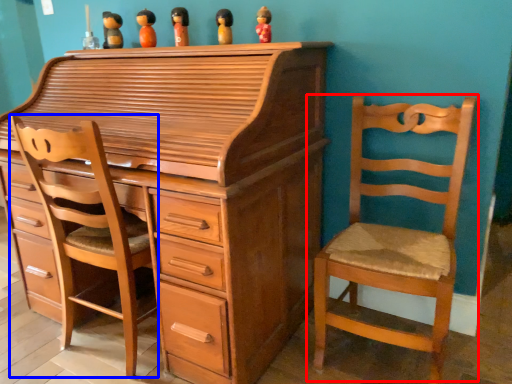
Question: Which point is further to the camera, chair (highlighted by a red box) or swivel chair (highlighted by a blue box)?

Choices:
 (A) chair
 (B) swivel chair

Answer: (B)